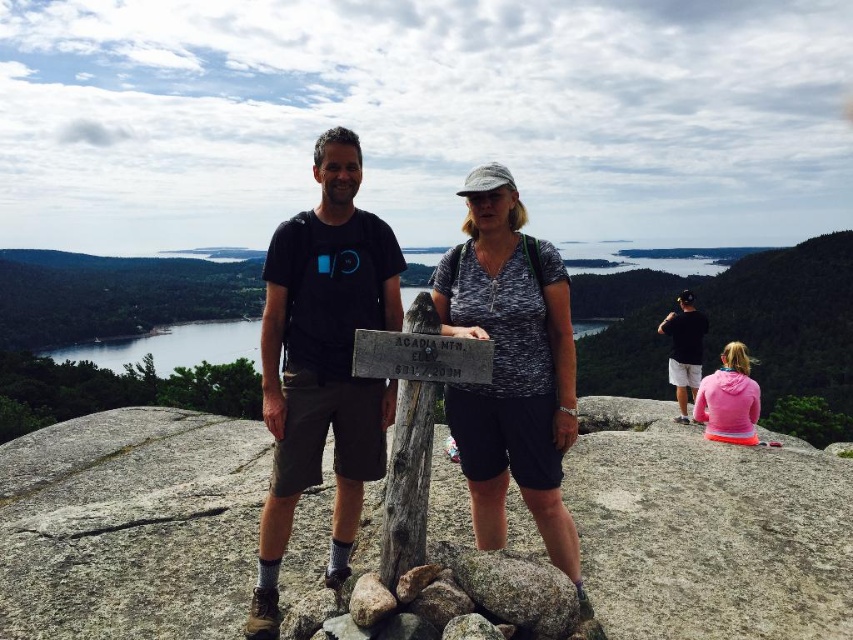
Does matte black t-shirt at center appear under gray wood sign at center?

Actually, matte black t-shirt at center is above gray wood sign at center.

Which is in front, point (325, 177) or point (376, 355)?

Positioned in front is point (376, 355).

The image size is (853, 640). Identify the location of matte black t-shirt at center. pyautogui.click(x=322, y=360).

Does black t-shirt at center appear on the left side of gray wood sign at center?

Yes, black t-shirt at center is to the left of gray wood sign at center.

Consider the image. Who is lower down, black t-shirt at center or gray wood sign at center?

gray wood sign at center is below.

Image resolution: width=853 pixels, height=640 pixels. I want to click on black t-shirt at center, so click(x=323, y=364).

Who is taller, matte black t-shirt at center or black t-shirt at center?

black t-shirt at center

Is matte black t-shirt at center further to the viewer compared to black t-shirt at center?

No.

At what (x,y) coordinates should I click in order to perform the action: click on matte black t-shirt at center. Please return your answer as a coordinate pair (x, y). Looking at the image, I should click on (322, 360).

Find the location of a particular element. matte black t-shirt at center is located at coordinates (322, 360).